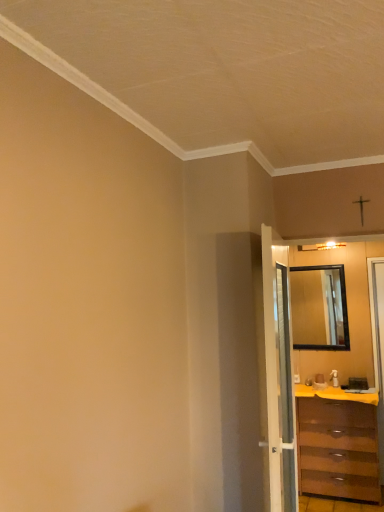
Question: Is brown wooden chest of drawers at right not close to yellow matte counter top at lower right?

Choices:
 (A) yes
 (B) no

Answer: (B)

Question: Is yellow matte counter top at lower right located within brown wooden chest of drawers at right?

Choices:
 (A) no
 (B) yes

Answer: (B)

Question: Does brown wooden chest of drawers at right have a lesser width compared to yellow matte counter top at lower right?

Choices:
 (A) no
 (B) yes

Answer: (B)

Question: Does brown wooden chest of drawers at right lie behind yellow matte counter top at lower right?

Choices:
 (A) no
 (B) yes

Answer: (A)

Question: Can you confirm if brown wooden chest of drawers at right is wider than yellow matte counter top at lower right?

Choices:
 (A) no
 (B) yes

Answer: (A)

Question: Considering the positions of brown wooden chest of drawers at right and white glossy door at center in the image, is brown wooden chest of drawers at right taller or shorter than white glossy door at center?

Choices:
 (A) tall
 (B) short

Answer: (B)

Question: Considering the positions of brown wooden chest of drawers at right and white glossy door at center in the image, is brown wooden chest of drawers at right wider or thinner than white glossy door at center?

Choices:
 (A) thin
 (B) wide

Answer: (B)

Question: From a real-world perspective, relative to white glossy door at center, is brown wooden chest of drawers at right vertically above or below?

Choices:
 (A) below
 (B) above

Answer: (A)

Question: In the image, is brown wooden chest of drawers at right positioned in front of or behind white glossy door at center?

Choices:
 (A) front
 (B) behind

Answer: (B)

Question: Would you say black glass mirror at right is inside or outside white glossy door at center?

Choices:
 (A) outside
 (B) inside

Answer: (A)

Question: Does point (331, 274) appear closer or farther from the camera than point (273, 463)?

Choices:
 (A) farther
 (B) closer

Answer: (A)

Question: In terms of height, does black glass mirror at right look taller or shorter compared to white glossy door at center?

Choices:
 (A) short
 (B) tall

Answer: (A)

Question: From a real-world perspective, relative to white glossy door at center, is black glass mirror at right vertically above or below?

Choices:
 (A) below
 (B) above

Answer: (B)

Question: Considering the relative positions of yellow matte counter top at lower right and brown wooden chest of drawers at right in the image provided, is yellow matte counter top at lower right to the left or to the right of brown wooden chest of drawers at right?

Choices:
 (A) left
 (B) right

Answer: (B)

Question: Considering their positions, is yellow matte counter top at lower right located in front of or behind brown wooden chest of drawers at right?

Choices:
 (A) behind
 (B) front

Answer: (A)